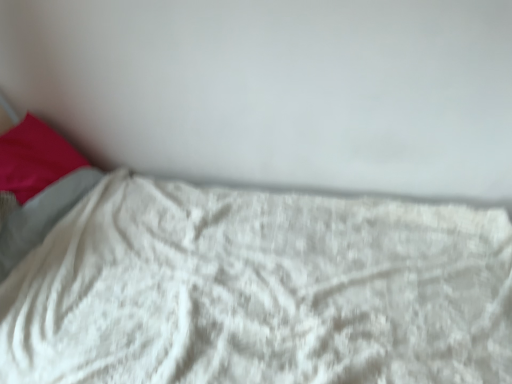
Question: From the image's perspective, relative to white fluffy blanket at lower center, is matte pink pillow at left above or below?

Choices:
 (A) above
 (B) below

Answer: (A)

Question: Considering the positions of matte pink pillow at left and white fluffy blanket at lower center in the image, is matte pink pillow at left wider or thinner than white fluffy blanket at lower center?

Choices:
 (A) wide
 (B) thin

Answer: (B)

Question: Looking at the image, does matte pink pillow at left seem bigger or smaller compared to white fluffy blanket at lower center?

Choices:
 (A) small
 (B) big

Answer: (A)

Question: Based on their positions, is white fluffy blanket at lower center located to the left or right of matte pink pillow at left?

Choices:
 (A) right
 (B) left

Answer: (A)

Question: From a real-world perspective, is white fluffy blanket at lower center positioned above or below matte pink pillow at left?

Choices:
 (A) below
 (B) above

Answer: (A)

Question: Would you say white fluffy blanket at lower center is inside or outside matte pink pillow at left?

Choices:
 (A) inside
 (B) outside

Answer: (B)

Question: Is point (124, 350) closer or farther from the camera than point (15, 135)?

Choices:
 (A) closer
 (B) farther

Answer: (A)